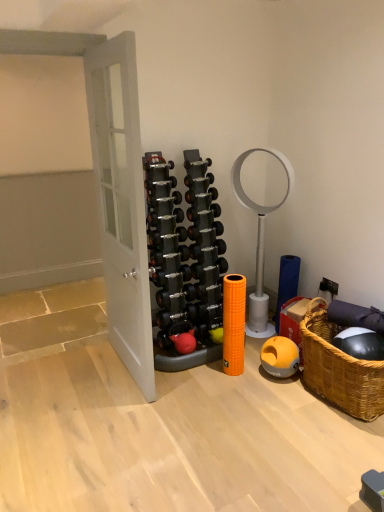
This screenshot has width=384, height=512. Identify the location of free space to the right of white matte door at left. (211, 385).